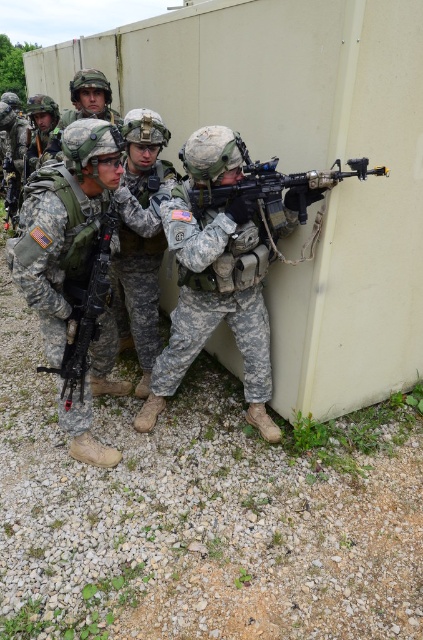
You are a drone operator trying to identify two points of interest in the scene. The first point is labeled as point (107, 269) and the second is point (125, 168). Which of these two points is closer to the camera?

Point (107, 269) is closer to the camera than point (125, 168).

You are a photographer trying to capture a closeup of the matte black rifle at center without including the camouflage uniform at left in the frame. Given their relative sizes, is this possible?

The camouflage uniform at left has a lesser width compared to the matte black rifle at center, so it is possible to frame the matte black rifle at center without including the camouflage uniform at left.

You are a soldier in the group and need to retrieve an object located at point (32, 273). The object is 2.52 meters away from you. Your rifle has a maximum effective range of 300 meters. Can you safely reach the object without moving from your current position?

The point (32, 273) is 2.52 meters away from the viewer. Since your rifle has a maximum effective range of 300 meters, you can safely reach the object without moving from your current position.